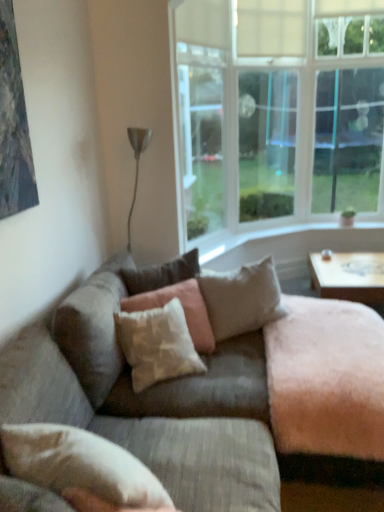
Question: From the image's perspective, is white fabric pillow at lower left, the fourth pillow in the back-to-front sequence, under light beige fabric pillow at center, the 2th pillow viewed from the back?

Choices:
 (A) yes
 (B) no

Answer: (A)

Question: Is white fabric pillow at lower left, the first pillow in the front-to-back sequence, positioned with its back to light beige fabric pillow at center, the 2th pillow viewed from the back?

Choices:
 (A) no
 (B) yes

Answer: (A)

Question: Is light beige fabric pillow at center, the 2th pillow viewed from the back, located within white fabric pillow at lower left, the first pillow in the front-to-back sequence?

Choices:
 (A) yes
 (B) no

Answer: (B)

Question: Considering the relative sizes of white fabric pillow at lower left, the fourth pillow in the back-to-front sequence, and light beige fabric pillow at center, marked as the 3th pillow in a front-to-back arrangement, in the image provided, is white fabric pillow at lower left, the fourth pillow in the back-to-front sequence, shorter than light beige fabric pillow at center, marked as the 3th pillow in a front-to-back arrangement,?

Choices:
 (A) no
 (B) yes

Answer: (B)

Question: From a real-world perspective, is white fabric pillow at lower left, the first pillow in the front-to-back sequence, positioned over light beige fabric pillow at center, the 2th pillow viewed from the back, based on gravity?

Choices:
 (A) no
 (B) yes

Answer: (B)

Question: Would you say beige textured pillow at center, which is counted as the first pillow, starting from the back, is inside or outside clear glass window at upper right, marked as the first window screen in a right-to-left arrangement?

Choices:
 (A) inside
 (B) outside

Answer: (B)

Question: Visually, is beige textured pillow at center, the fourth pillow in the front-to-back sequence, positioned to the left or to the right of clear glass window at upper right, marked as the first window screen in a right-to-left arrangement?

Choices:
 (A) right
 (B) left

Answer: (B)

Question: From the image's perspective, is beige textured pillow at center, the fourth pillow in the front-to-back sequence, positioned above or below clear glass window at upper right, marked as the first window screen in a right-to-left arrangement?

Choices:
 (A) above
 (B) below

Answer: (B)

Question: Is point (185, 257) positioned closer to the camera than point (359, 184)?

Choices:
 (A) farther
 (B) closer

Answer: (B)

Question: From a real-world perspective, relative to transparent glass window at center, which is counted as the 2th window screen, starting from the right, is textured beige pillow at center, the second pillow from the front, vertically above or below?

Choices:
 (A) above
 (B) below

Answer: (B)

Question: From the image's perspective, is textured beige pillow at center, the third pillow in the back-to-front sequence, above or below transparent glass window at center, which is counted as the 2th window screen, starting from the right?

Choices:
 (A) above
 (B) below

Answer: (B)

Question: Do you think textured beige pillow at center, the second pillow from the front, is within transparent glass window at center, which is counted as the 2th window screen, starting from the right, or outside of it?

Choices:
 (A) outside
 (B) inside

Answer: (A)

Question: In the image, is textured beige pillow at center, the second pillow from the front, positioned in front of or behind transparent glass window at center, the 2th window screen when ordered from left to right?

Choices:
 (A) behind
 (B) front

Answer: (B)

Question: Is clear glass window at upper right, marked as the first window screen in a right-to-left arrangement, to the left or to the right of wooden coffee table at right in the image?

Choices:
 (A) right
 (B) left

Answer: (A)

Question: In terms of size, does clear glass window at upper right, marked as the first window screen in a right-to-left arrangement, appear bigger or smaller than wooden coffee table at right?

Choices:
 (A) small
 (B) big

Answer: (A)